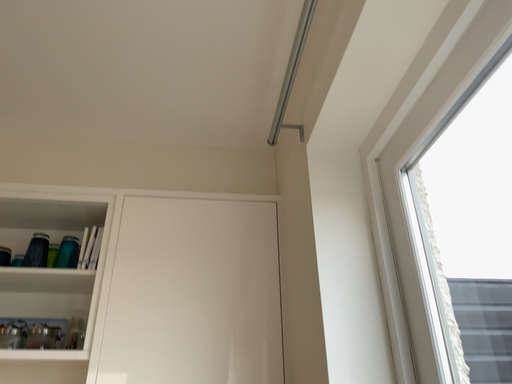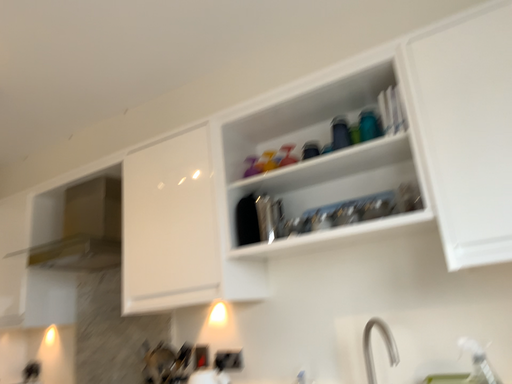
Question: Which way did the camera rotate in the video?

Choices:
 (A) rotated upward
 (B) rotated downward

Answer: (B)